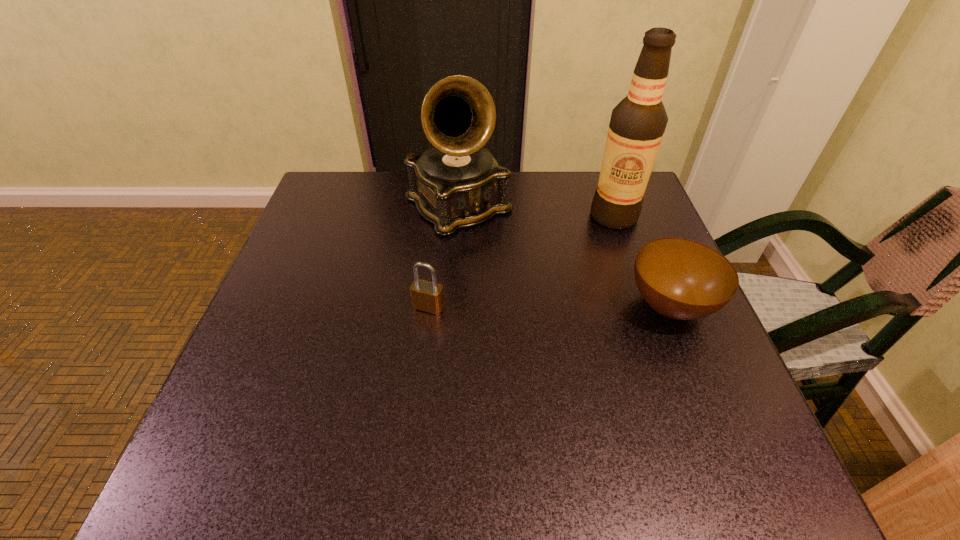
You are a GUI agent. You are given a task and a screenshot of the screen. Output one action in this format:
    pyautogui.click(x=<x>, y=<y>)
    Task: Click on the padlock
    
    Given the screenshot: What is the action you would take?
    pyautogui.click(x=427, y=296)

You are a GUI agent. You are given a task and a screenshot of the screen. Output one action in this format:
    pyautogui.click(x=<x>, y=<y>)
    Task: Click on the shortest object
    This screenshot has height=540, width=960.
    Given the screenshot: What is the action you would take?
    pyautogui.click(x=682, y=279)

Locate an element on the screen. the third shortest object is located at coordinates (457, 183).

The height and width of the screenshot is (540, 960). In order to click on alcohol in this screenshot , I will do `click(637, 125)`.

Find the location of a particular element. The image size is (960, 540). vacant space located on the back of the padlock is located at coordinates (432, 281).

Image resolution: width=960 pixels, height=540 pixels. I want to click on vacant space situated on the front of the bowl, so click(693, 364).

Find the location of a particular element. vacant space located 0.160m on the horn of the second tallest object is located at coordinates (526, 280).

You are a GUI agent. You are given a task and a screenshot of the screen. Output one action in this format:
    pyautogui.click(x=<x>, y=<y>)
    Task: Click on the free spot located on the horn of the second tallest object
    
    Given the screenshot: What is the action you would take?
    click(x=583, y=339)

This screenshot has height=540, width=960. In order to click on free space located on the horn of the second tallest object in this screenshot , I will do `click(587, 342)`.

Find the location of a particular element. This screenshot has height=540, width=960. vacant region located on the label of the alcohol is located at coordinates (513, 309).